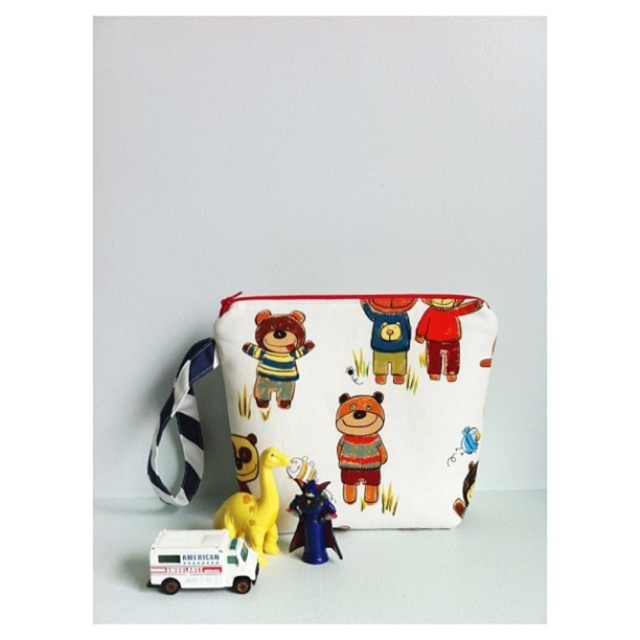
You are organizing a toy display and need to stack the white plastic toy car at lower left and the metallic blue figurine at lower center. Which toy should you place at the bottom to ensure stability?

The metallic blue figurine at lower center is taller than the white plastic toy car at lower left, so placing the taller figurine at the bottom will provide better stability for the stack.